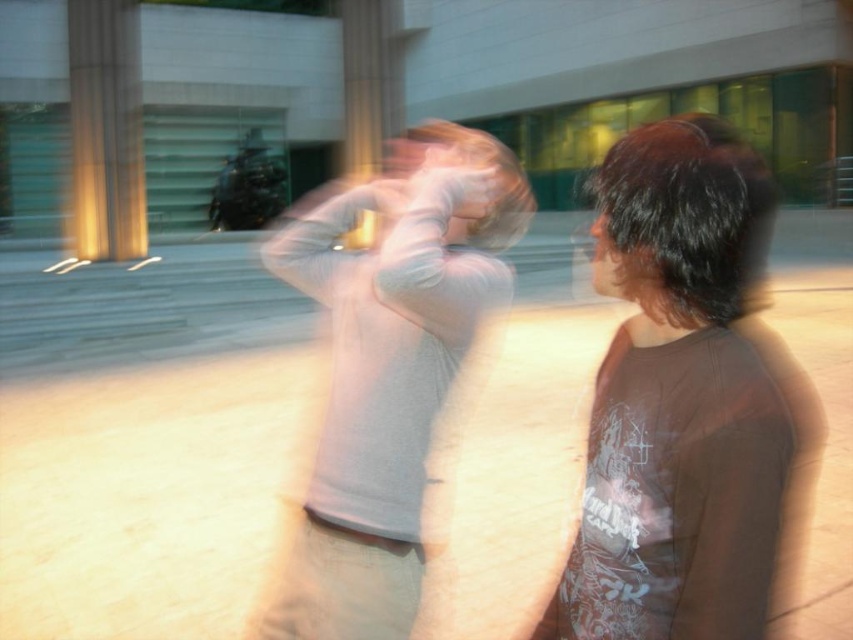
Question: Estimate the real-world distances between objects in this image. Which object is closer to the golden polished pillar at left?

Choices:
 (A) light gray cotton shirt at center
 (B) dark brown t-shirt at right

Answer: (A)

Question: Estimate the real-world distances between objects in this image. Which object is closer to the dark brown t-shirt at right?

Choices:
 (A) golden polished pillar at left
 (B) light gray cotton shirt at center

Answer: (B)

Question: From the image, what is the correct spatial relationship of dark brown t-shirt at right in relation to golden polished pillar at left?

Choices:
 (A) above
 (B) below

Answer: (B)

Question: Among these objects, which one is nearest to the camera?

Choices:
 (A) dark brown t-shirt at right
 (B) golden polished pillar at left

Answer: (A)

Question: Is dark brown t-shirt at right below light gray cotton shirt at center?

Choices:
 (A) no
 (B) yes

Answer: (B)

Question: Is dark brown t-shirt at right positioned behind golden polished pillar at left?

Choices:
 (A) no
 (B) yes

Answer: (A)